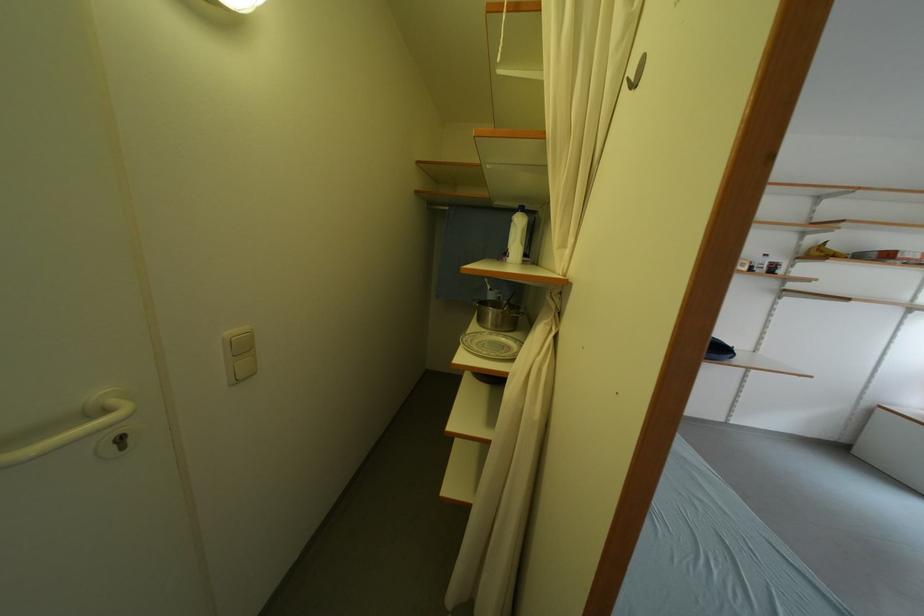
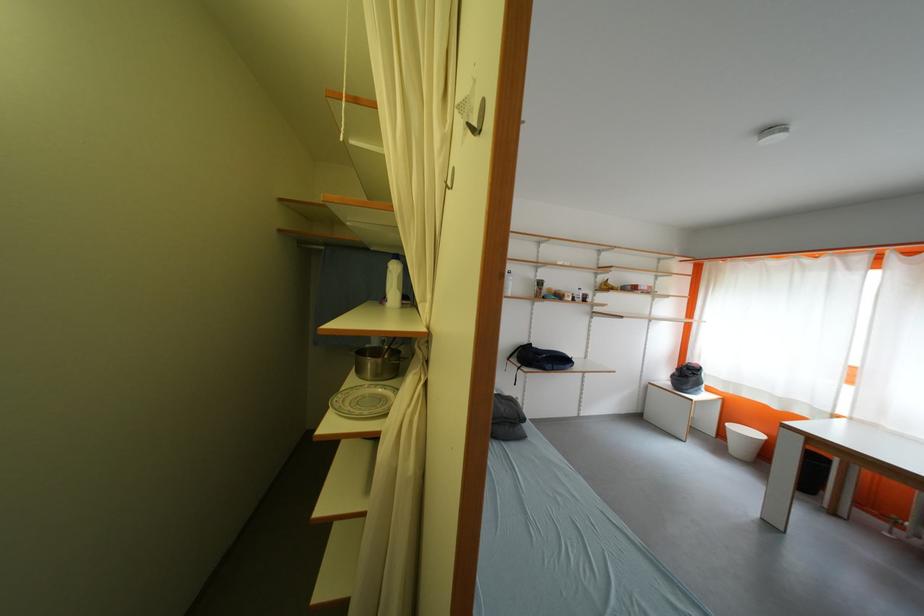
Question: The camera is either moving clockwise (left) or counter-clockwise (right) around the object. The first image is from the beginning of the video and the second image is from the end. Is the camera moving left or right when shooting the video?

Choices:
 (A) Left
 (B) Right

Answer: (A)